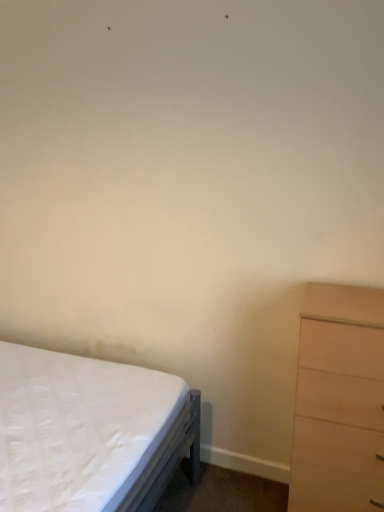
Question: Can you confirm if white quilted mattress at lower left is wider than light brown wood chest of drawers at right?

Choices:
 (A) yes
 (B) no

Answer: (A)

Question: Can you confirm if white quilted mattress at lower left is shorter than light brown wood chest of drawers at right?

Choices:
 (A) yes
 (B) no

Answer: (A)

Question: Is white quilted mattress at lower left at the right side of light brown wood chest of drawers at right?

Choices:
 (A) no
 (B) yes

Answer: (A)

Question: Is white quilted mattress at lower left not within light brown wood chest of drawers at right?

Choices:
 (A) yes
 (B) no

Answer: (A)

Question: From the image's perspective, is white quilted mattress at lower left beneath light brown wood chest of drawers at right?

Choices:
 (A) yes
 (B) no

Answer: (A)

Question: Is white quilted mattress at lower left positioned with its back to light brown wood chest of drawers at right?

Choices:
 (A) yes
 (B) no

Answer: (B)

Question: From the image's perspective, does light brown wood chest of drawers at right appear lower than white quilted mattress at lower left?

Choices:
 (A) yes
 (B) no

Answer: (B)

Question: Is white quilted mattress at lower left located within light brown wood chest of drawers at right?

Choices:
 (A) yes
 (B) no

Answer: (B)

Question: Is light brown wood chest of drawers at right far away from white quilted mattress at lower left?

Choices:
 (A) yes
 (B) no

Answer: (B)

Question: Considering the relative sizes of light brown wood chest of drawers at right and white quilted mattress at lower left in the image provided, is light brown wood chest of drawers at right smaller than white quilted mattress at lower left?

Choices:
 (A) yes
 (B) no

Answer: (A)

Question: Considering the relative sizes of light brown wood chest of drawers at right and white quilted mattress at lower left in the image provided, is light brown wood chest of drawers at right taller than white quilted mattress at lower left?

Choices:
 (A) yes
 (B) no

Answer: (A)

Question: Could you tell me if light brown wood chest of drawers at right is turned towards white quilted mattress at lower left?

Choices:
 (A) no
 (B) yes

Answer: (A)

Question: Which is correct: white quilted mattress at lower left is inside light brown wood chest of drawers at right, or outside of it?

Choices:
 (A) inside
 (B) outside

Answer: (B)